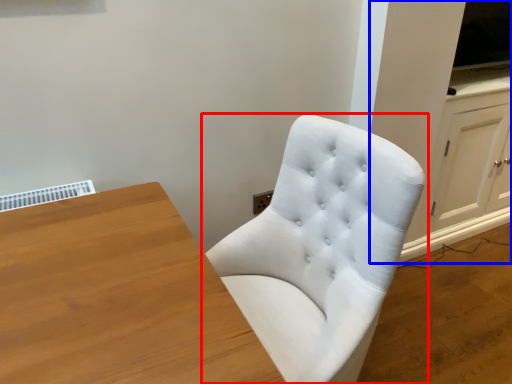
Question: Among these objects, which one is farthest to the camera, chair (highlighted by a red box) or dresser (highlighted by a blue box)?

Choices:
 (A) chair
 (B) dresser

Answer: (B)